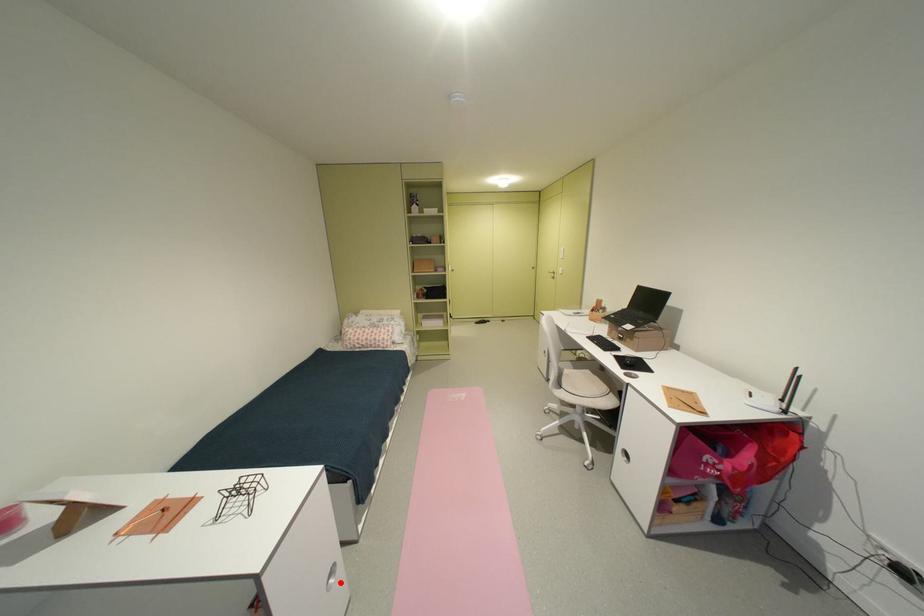
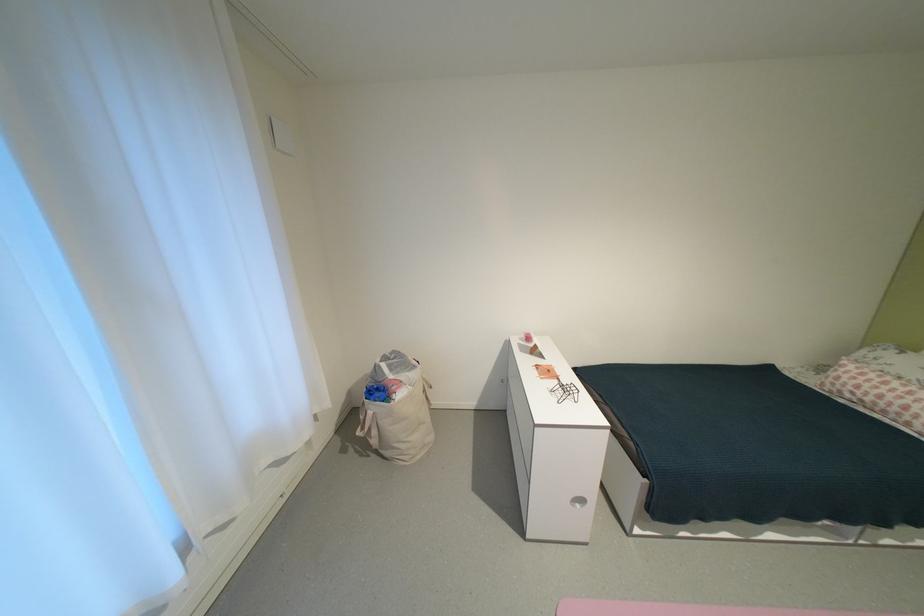
Question: I am providing you with two images of the same scene from different viewpoints. A red point is shown in image1. For the corresponding object point in image2, is it positioned nearer or farther from the camera?

Choices:
 (A) Nearer
 (B) Farther

Answer: (B)